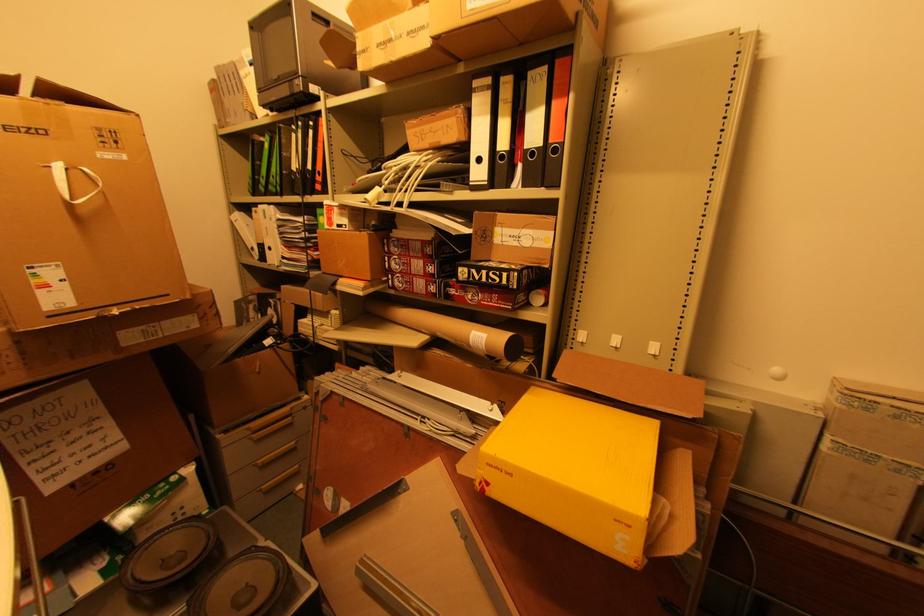
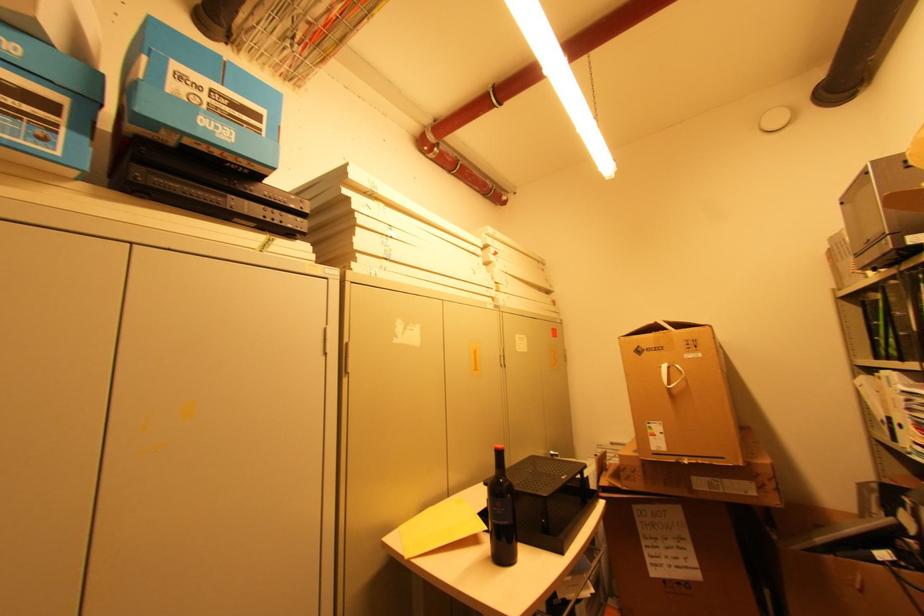
Question: The images are taken continuously from a first-person perspective. In which direction is your viewpoint rotating?

Choices:
 (A) Left
 (B) Right
 (C) Up
 (D) Down

Answer: (A)